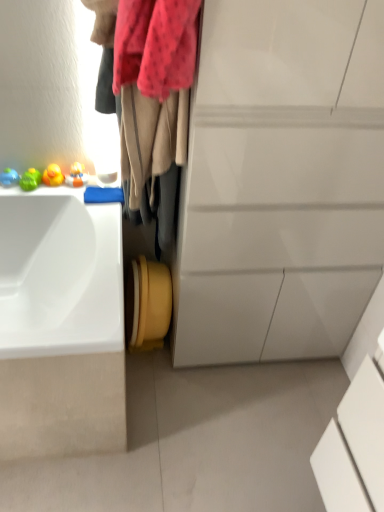
Question: From the image's perspective, is white glossy cabinet at center above or below velvet beige scarf at upper left?

Choices:
 (A) below
 (B) above

Answer: (A)

Question: In terms of height, does white glossy cabinet at center look taller or shorter compared to velvet beige scarf at upper left?

Choices:
 (A) short
 (B) tall

Answer: (B)

Question: Which object is positioned farthest from the velvet beige scarf at upper left?

Choices:
 (A) white glossy cabinet at center
 (B) white glossy sink at left

Answer: (B)

Question: Estimate the real-world distances between objects in this image. Which object is closer to the white glossy cabinet at center?

Choices:
 (A) velvet beige scarf at upper left
 (B) white glossy sink at left

Answer: (A)